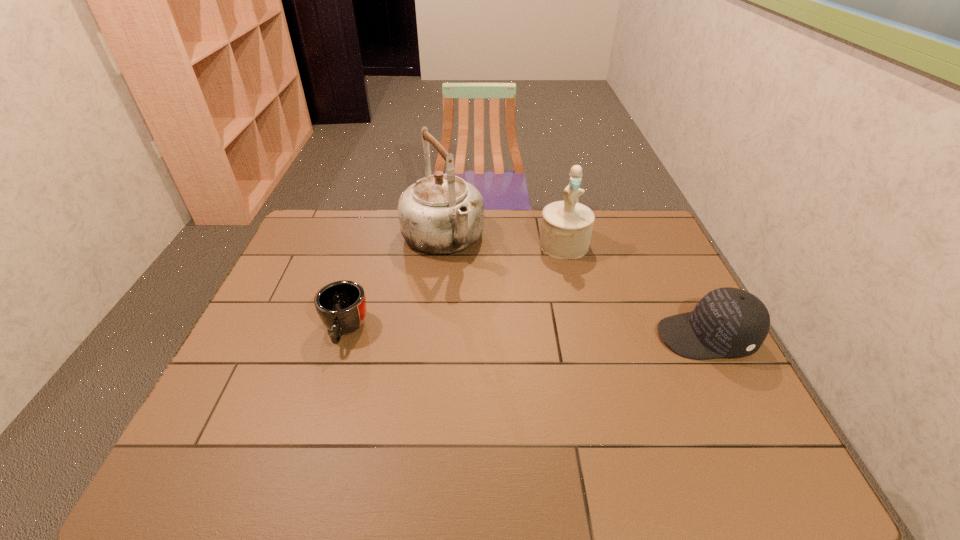
Find the location of a particular element. The height and width of the screenshot is (540, 960). object situated at the right edge is located at coordinates (727, 322).

Find the location of a particular element. free region at the far edge of the desktop is located at coordinates (400, 239).

Where is `blank space at the near edge of the desktop`? blank space at the near edge of the desktop is located at coordinates (470, 421).

This screenshot has width=960, height=540. In order to click on blank area at the right edge in this screenshot , I will do `click(650, 273)`.

The width and height of the screenshot is (960, 540). Find the location of `vacant space at the far left corner of the desktop`. vacant space at the far left corner of the desktop is located at coordinates (309, 222).

At what (x,y) coordinates should I click in order to perform the action: click on free space at the far right corner of the desktop. Please return your answer as a coordinate pair (x, y). Looking at the image, I should click on click(624, 229).

The image size is (960, 540). Find the location of `vacant space at the near right corner`. vacant space at the near right corner is located at coordinates (692, 430).

Locate an element on the screen. The width and height of the screenshot is (960, 540). vacant space in between the tallest object and the rightmost object is located at coordinates pos(574,288).

At what (x,y) coordinates should I click in order to perform the action: click on vacant area that lies between the tallest object and the baseball cap. Please return your answer as a coordinate pair (x, y). Looking at the image, I should click on (574, 288).

You are a GUI agent. You are given a task and a screenshot of the screen. Output one action in this format:
    pyautogui.click(x=<x>, y=<y>)
    Task: Click on the vacant space that is in between the second object from left to right and the shortest object
    This screenshot has width=960, height=540.
    Given the screenshot: What is the action you would take?
    pyautogui.click(x=394, y=284)